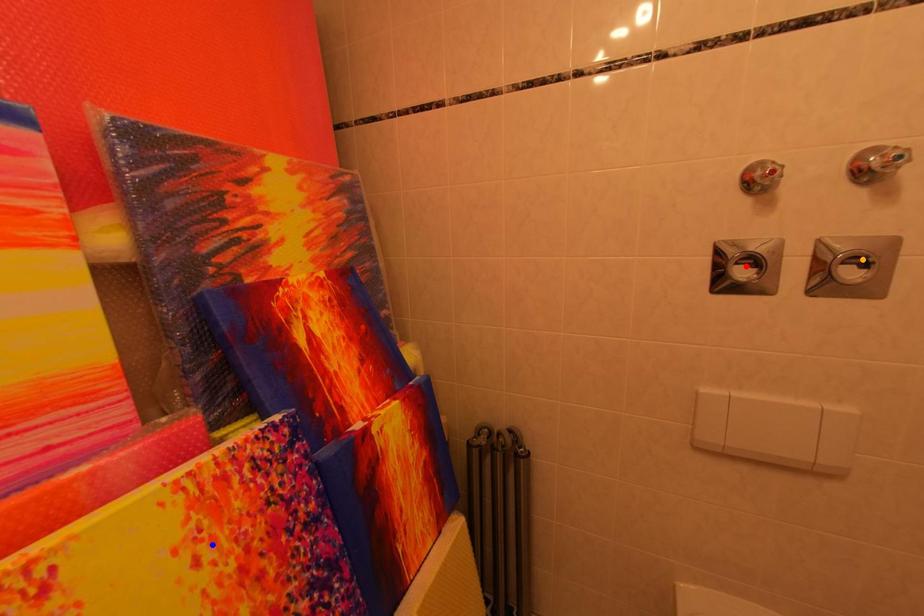
Order these from farthest to nearest:
A) orange point
B) blue point
C) red point

red point → orange point → blue point